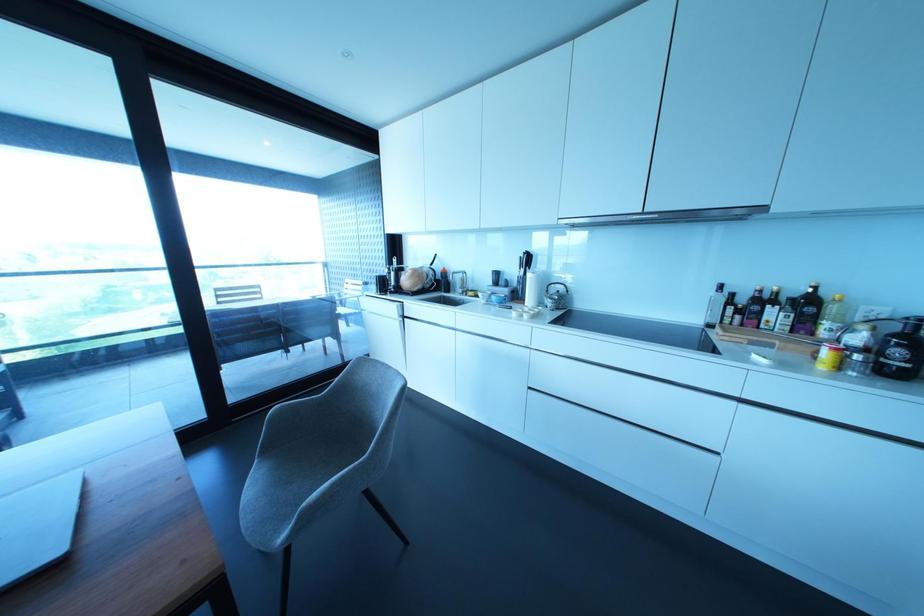
The image size is (924, 616). What do you see at coordinates (156, 177) in the screenshot?
I see `a sliding door frame` at bounding box center [156, 177].